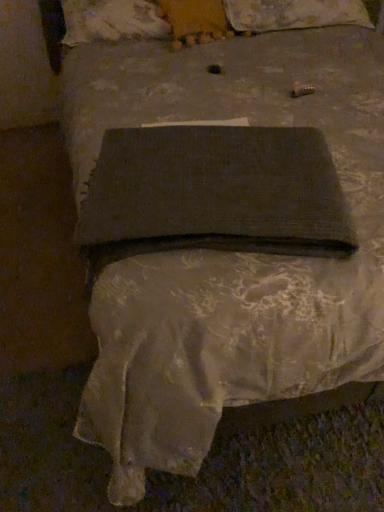
Question: Is dark fabric book at center facing towards fluffy white pillow at upper center, the first pillow viewed from the right?

Choices:
 (A) yes
 (B) no

Answer: (B)

Question: Is dark fabric book at center thinner than fluffy white pillow at upper center, the 2th pillow in the left-to-right sequence?

Choices:
 (A) no
 (B) yes

Answer: (B)

Question: Is fluffy white pillow at upper center, the 2th pillow in the left-to-right sequence, completely or partially inside dark fabric book at center?

Choices:
 (A) yes
 (B) no

Answer: (B)

Question: Can you confirm if dark fabric book at center is taller than fluffy white pillow at upper center, the 2th pillow in the left-to-right sequence?

Choices:
 (A) yes
 (B) no

Answer: (B)

Question: From a real-world perspective, is dark fabric book at center over fluffy white pillow at upper center, the 2th pillow in the left-to-right sequence?

Choices:
 (A) no
 (B) yes

Answer: (B)

Question: From a real-world perspective, is dark fabric book at center positioned above or below fluffy white pillow at upper center, the 2th pillow in the left-to-right sequence?

Choices:
 (A) above
 (B) below

Answer: (A)

Question: Considering the positions of dark fabric book at center and fluffy white pillow at upper center, the 2th pillow in the left-to-right sequence, in the image, is dark fabric book at center taller or shorter than fluffy white pillow at upper center, the 2th pillow in the left-to-right sequence,?

Choices:
 (A) short
 (B) tall

Answer: (A)

Question: Is dark fabric book at center in front of or behind fluffy white pillow at upper center, the 2th pillow in the left-to-right sequence, in the image?

Choices:
 (A) behind
 (B) front

Answer: (B)

Question: Is dark fabric book at center wider or thinner than fluffy white pillow at upper center, the first pillow viewed from the right?

Choices:
 (A) thin
 (B) wide

Answer: (A)

Question: Choose the correct answer: Is fluffy white pillow at upper center, the 2th pillow in the left-to-right sequence, inside fluffy beige pillow at upper center, the first pillow from the left, or outside it?

Choices:
 (A) outside
 (B) inside

Answer: (A)

Question: Is fluffy white pillow at upper center, the 2th pillow in the left-to-right sequence, taller or shorter than fluffy beige pillow at upper center, which ranks as the 2th pillow in right-to-left order?

Choices:
 (A) short
 (B) tall

Answer: (A)

Question: Does point (302, 27) appear closer or farther from the camera than point (99, 22)?

Choices:
 (A) farther
 (B) closer

Answer: (A)

Question: From the image's perspective, is fluffy white pillow at upper center, the first pillow viewed from the right, located above or below fluffy beige pillow at upper center, which ranks as the 2th pillow in right-to-left order?

Choices:
 (A) above
 (B) below

Answer: (A)

Question: Considering the positions of point (306, 13) and point (130, 154), is point (306, 13) closer or farther from the camera than point (130, 154)?

Choices:
 (A) closer
 (B) farther

Answer: (B)

Question: From a real-world perspective, relative to dark fabric book at center, is fluffy white pillow at upper center, the first pillow viewed from the right, vertically above or below?

Choices:
 (A) above
 (B) below

Answer: (B)